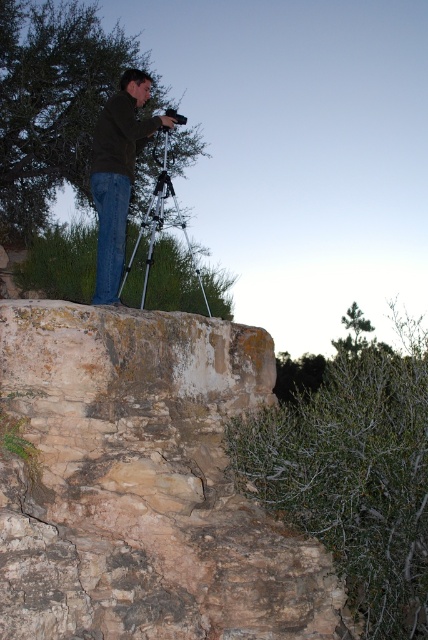
Which of these two, dark brown leather jacket at center or silver metallic tripod at center, stands taller?

With more height is silver metallic tripod at center.

Is dark brown leather jacket at center bigger than silver metallic tripod at center?

Actually, dark brown leather jacket at center might be smaller than silver metallic tripod at center.

Between point (97, 172) and point (163, 172), which one is positioned in front?

Point (97, 172) is more forward.

I want to click on dark brown leather jacket at center, so click(118, 173).

Is point (12, 625) less distant than point (165, 150)?

Yes.

Which is behind, point (172, 352) or point (163, 150)?

The point (163, 150) is behind.

Between point (279, 541) and point (148, 243), which one is positioned in front?

Point (279, 541)

Locate an element on the screen. This screenshot has height=640, width=428. rustic stone cliff at center is located at coordinates [142, 484].

Is point (216, 419) positioned in front of point (98, 120)?

Yes, it is.

Can you confirm if rustic stone cliff at center is taller than dark brown leather jacket at center?

No, rustic stone cliff at center is not taller than dark brown leather jacket at center.

What do you see at coordinates (142, 484) in the screenshot? The width and height of the screenshot is (428, 640). I see `rustic stone cliff at center` at bounding box center [142, 484].

The width and height of the screenshot is (428, 640). Identify the location of rustic stone cliff at center. (142, 484).